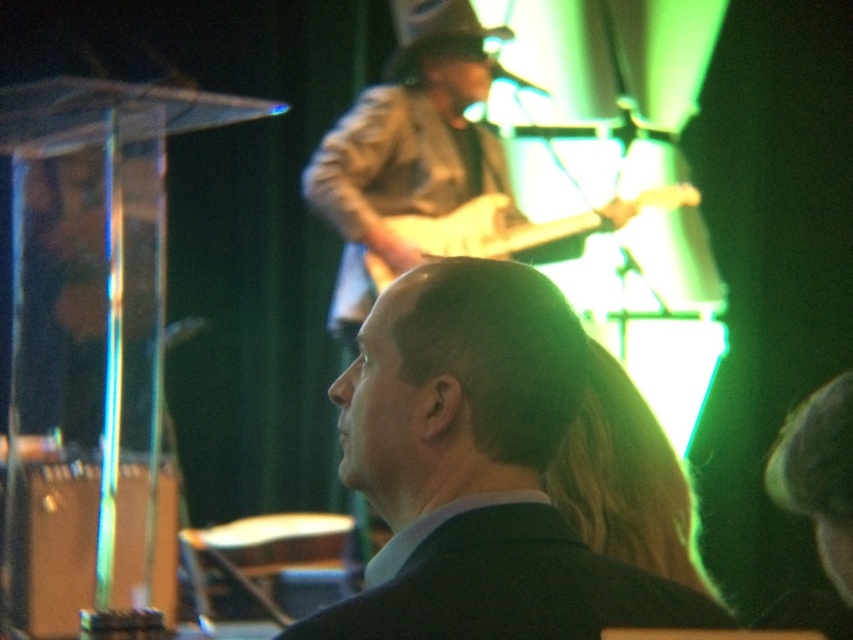
Where is `black suit at center`? This screenshot has width=853, height=640. black suit at center is located at coordinates (477, 468).

Which of these two, black suit at center or light brown wood guitar at center, stands shorter?

black suit at center

Who is more forward, (556, 296) or (463, 237)?

Point (556, 296) is in front.

Locate an element on the screen. This screenshot has height=640, width=853. black suit at center is located at coordinates point(477,468).

How much distance is there between black matte suit at center and light brown wood guitar at center?

black matte suit at center is 3.47 meters away from light brown wood guitar at center.

Is black matte suit at center behind light brown wood guitar at center?

No, black matte suit at center is in front of light brown wood guitar at center.

Is point (310, 621) more distant than point (503, 221)?

No.

This screenshot has width=853, height=640. I want to click on black matte suit at center, so click(x=502, y=580).

Which is above, black suit at center or black matte suit at center?

Positioned higher is black suit at center.

Which of these two, black suit at center or black matte suit at center, stands shorter?

black matte suit at center

Looking at this image, who is more forward, (492, 483) or (546, 529)?

Point (546, 529) is in front.

I want to click on black suit at center, so click(x=477, y=468).